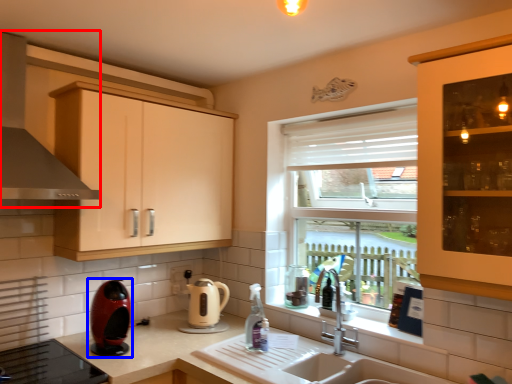
Question: Which point is further to the camera, exhaust hood (highlighted by a red box) or home appliance (highlighted by a blue box)?

Choices:
 (A) exhaust hood
 (B) home appliance

Answer: (B)